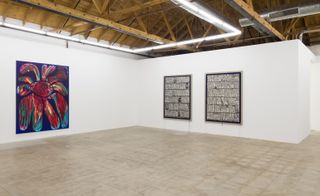
Locate an element on the screen. The image size is (320, 196). black frames on the paintings is located at coordinates (164, 105), (206, 102).